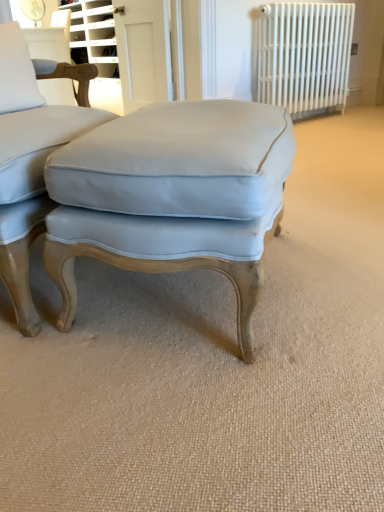
What do you see at coordinates (302, 56) in the screenshot? This screenshot has height=512, width=384. I see `white metal radiator at upper right` at bounding box center [302, 56].

The image size is (384, 512). What do you see at coordinates (143, 52) in the screenshot?
I see `white glossy door at upper center` at bounding box center [143, 52].

This screenshot has height=512, width=384. I want to click on light blue fabric stool at center, so click(172, 196).

Is light blue fabric stool at center wider than white metal radiator at upper right?

Yes, light blue fabric stool at center is wider than white metal radiator at upper right.

From the image's perspective, is light blue fabric stool at center below white metal radiator at upper right?

Correct, light blue fabric stool at center appears lower than white metal radiator at upper right in the image.

Looking at this image, is light blue fabric stool at center closer to camera compared to white metal radiator at upper right?

That is True.

Is white glossy door at upper center inside or outside of light blue fabric stool at center?

white glossy door at upper center cannot be found inside light blue fabric stool at center.

Measure the distance from white glossy door at upper center to light blue fabric stool at center.

2.15 meters.

Is the depth of white glossy door at upper center less than that of light blue fabric stool at center?

No, the depth of white glossy door at upper center is greater than that of light blue fabric stool at center.

In terms of width, does white glossy door at upper center look wider or thinner when compared to light blue fabric stool at center?

Considering their sizes, white glossy door at upper center looks slimmer than light blue fabric stool at center.

Is light blue fabric ottoman at center completely or partially outside of white glossy door at upper center?

Indeed, light blue fabric ottoman at center is completely outside white glossy door at upper center.

Is light blue fabric ottoman at center next to white glossy door at upper center and touching it?

light blue fabric ottoman at center and white glossy door at upper center are clearly separated.

Considering the sizes of light blue fabric ottoman at center and white glossy door at upper center in the image, is light blue fabric ottoman at center wider or thinner than white glossy door at upper center?

Considering their sizes, light blue fabric ottoman at center looks broader than white glossy door at upper center.

Does light blue fabric ottoman at center have a larger size compared to light blue fabric stool at center?

Indeed, light blue fabric ottoman at center has a larger size compared to light blue fabric stool at center.

At what (x,y) coordinates should I click in order to perform the action: click on chair above the light blue fabric stool at center (from a real-world perspective). Please return your answer as a coordinate pair (x, y). This screenshot has height=512, width=384. Looking at the image, I should click on (31, 156).

Considering the positions of objects light blue fabric ottoman at center and light blue fabric stool at center in the image provided, who is more to the left, light blue fabric ottoman at center or light blue fabric stool at center?

Positioned to the left is light blue fabric ottoman at center.

Can you confirm if light blue fabric ottoman at center is thinner than light blue fabric stool at center?

In fact, light blue fabric ottoman at center might be wider than light blue fabric stool at center.

From a real-world perspective, between white metal radiator at upper right and light blue fabric ottoman at center, who is vertically lower?

light blue fabric ottoman at center, from a real-world perspective.

Can you tell me how much white metal radiator at upper right and light blue fabric ottoman at center differ in facing direction?

The angle between the facing direction of white metal radiator at upper right and the facing direction of light blue fabric ottoman at center is 34.7 degrees.

In the scene shown: Are white metal radiator at upper right and light blue fabric ottoman at center located far from each other?

Yes, white metal radiator at upper right is far from light blue fabric ottoman at center.

Locate an element on the screen. chair below the white metal radiator at upper right (from the image's perspective) is located at coordinates (31, 156).

From their relative heights in the image, would you say light blue fabric stool at center is taller or shorter than white glossy door at upper center?

light blue fabric stool at center is shorter than white glossy door at upper center.

From the image's perspective, is light blue fabric stool at center on white glossy door at upper center?

Incorrect, from the image's perspective, light blue fabric stool at center is lower than white glossy door at upper center.

Is white glossy door at upper center surrounded by light blue fabric stool at center?

No, light blue fabric stool at center does not contain white glossy door at upper center.

This screenshot has height=512, width=384. Find the location of `stool directly beneath the white glossy door at upper center (from a real-world perspective)`. stool directly beneath the white glossy door at upper center (from a real-world perspective) is located at coordinates (172, 196).

From the image's perspective, which is above, white glossy door at upper center or white metal radiator at upper right?

white metal radiator at upper right is shown above in the image.

In the scene shown: Which object is further away from the camera, white glossy door at upper center or white metal radiator at upper right?

white glossy door at upper center is behind.

Is white glossy door at upper center positioned with its back to white metal radiator at upper right?

white glossy door at upper center does not have its back to white metal radiator at upper right.

Which of these two, white glossy door at upper center or white metal radiator at upper right, stands shorter?

white glossy door at upper center is shorter.

The height and width of the screenshot is (512, 384). In order to click on radiator that is above the light blue fabric stool at center (from the image's perspective) in this screenshot , I will do `click(302, 56)`.

There is a light blue fabric stool at center. Where is `screen door above it (from a real-world perspective)`? screen door above it (from a real-world perspective) is located at coordinates (143, 52).

Based on their spatial positions, is white metal radiator at upper right or light blue fabric ottoman at center closer to white glossy door at upper center?

The object closer to white glossy door at upper center is white metal radiator at upper right.

Based on their spatial positions, is light blue fabric ottoman at center or white metal radiator at upper right further from light blue fabric stool at center?

Among the two, white metal radiator at upper right is located further to light blue fabric stool at center.

Estimate the real-world distances between objects in this image. Which object is closer to light blue fabric stool at center, light blue fabric ottoman at center or white glossy door at upper center?

Among the two, light blue fabric ottoman at center is located nearer to light blue fabric stool at center.

Considering their positions, is white metal radiator at upper right positioned closer to white glossy door at upper center than light blue fabric stool at center?

white metal radiator at upper right lies closer to white glossy door at upper center than the other object.

When comparing their distances from white glossy door at upper center, does light blue fabric ottoman at center or white metal radiator at upper right seem further?

Among the two, light blue fabric ottoman at center is located further to white glossy door at upper center.

Considering their positions, is light blue fabric ottoman at center positioned closer to white metal radiator at upper right than white glossy door at upper center?

The object closer to white metal radiator at upper right is white glossy door at upper center.

When comparing their distances from white glossy door at upper center, does light blue fabric ottoman at center or light blue fabric stool at center seem further?

Based on the image, light blue fabric stool at center appears to be further to white glossy door at upper center.

Which object lies further to the anchor point light blue fabric ottoman at center, white metal radiator at upper right or white glossy door at upper center?

Based on the image, white metal radiator at upper right appears to be further to light blue fabric ottoman at center.

Locate an element on the screen. The height and width of the screenshot is (512, 384). stool positioned between light blue fabric ottoman at center and white metal radiator at upper right from near to far is located at coordinates (172, 196).

This screenshot has width=384, height=512. Identify the location of radiator between light blue fabric stool at center and white glossy door at upper center along the z-axis. [302, 56].

Where is `radiator between light blue fabric ottoman at center and white glossy door at upper center in the front-back direction`? The image size is (384, 512). radiator between light blue fabric ottoman at center and white glossy door at upper center in the front-back direction is located at coordinates (302, 56).

Find the location of a particular element. This screenshot has height=512, width=384. stool located between light blue fabric ottoman at center and white glossy door at upper center in the depth direction is located at coordinates (172, 196).